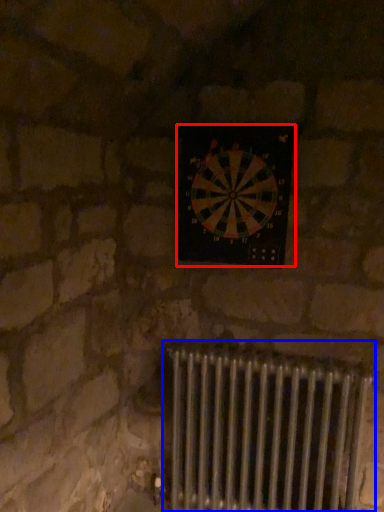
Question: Which point is closer to the camera, wall clock (highlighted by a red box) or radiator (highlighted by a blue box)?

Choices:
 (A) wall clock
 (B) radiator

Answer: (B)